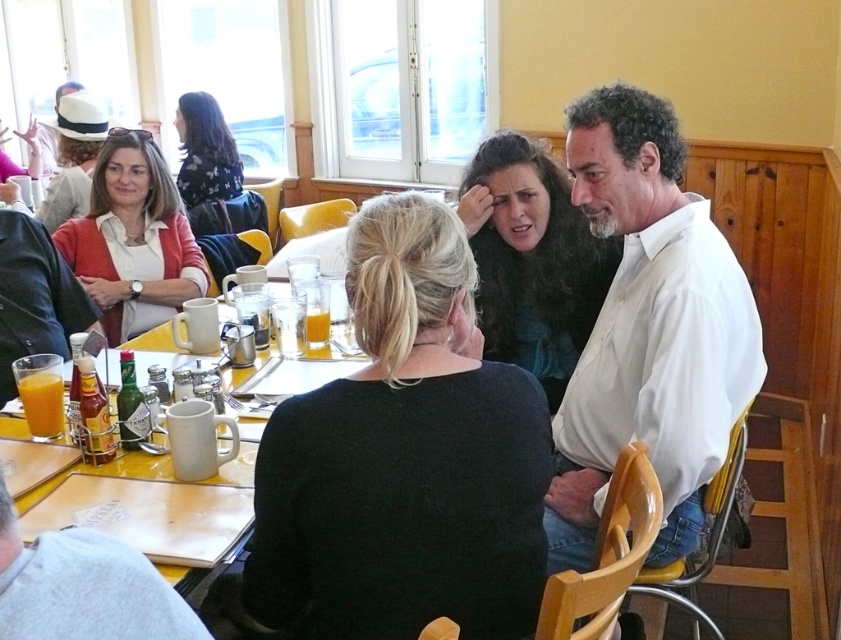
Which of these two, floral fabric shirt at upper left or translucent glass bottle at center, stands shorter?

translucent glass bottle at center is shorter.

Does floral fabric shirt at upper left appear on the right side of translucent glass bottle at center?

In fact, floral fabric shirt at upper left is to the left of translucent glass bottle at center.

What do you see at coordinates (205, 150) in the screenshot?
I see `floral fabric shirt at upper left` at bounding box center [205, 150].

The image size is (841, 640). Find the location of `floral fabric shirt at upper left`. floral fabric shirt at upper left is located at coordinates (205, 150).

Is translucent glass orange juice at lower left below translucent glass bottle at center?

Actually, translucent glass orange juice at lower left is above translucent glass bottle at center.

Does translucent glass orange juice at lower left appear on the right side of translucent glass bottle at center?

In fact, translucent glass orange juice at lower left is to the left of translucent glass bottle at center.

Does point (29, 416) lie behind point (93, 369)?

Yes, point (29, 416) is farther from viewer.

The height and width of the screenshot is (640, 841). Find the location of `translucent glass orange juice at lower left`. translucent glass orange juice at lower left is located at coordinates (41, 401).

How far apart are dark brown hair at center and translucent glass cup at center?

A distance of 34.08 inches exists between dark brown hair at center and translucent glass cup at center.

Does dark brown hair at center have a greater height compared to translucent glass cup at center?

Yes.

Identify the location of dark brown hair at center. (532, 259).

Identify the location of dark brown hair at center. (532, 259).